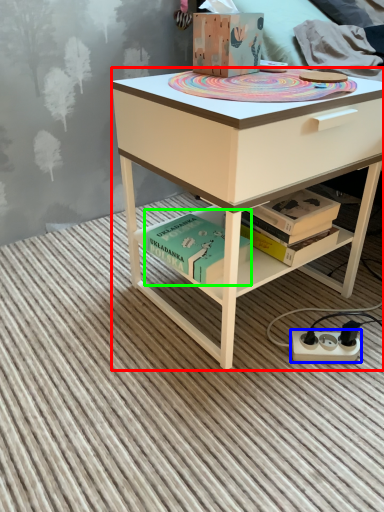
Question: Based on their relative distances, which object is farther from desk (highlighted by a red box)? Choose from power plugs and sockets (highlighted by a blue box) and book (highlighted by a green box).

Choices:
 (A) power plugs and sockets
 (B) book

Answer: (A)